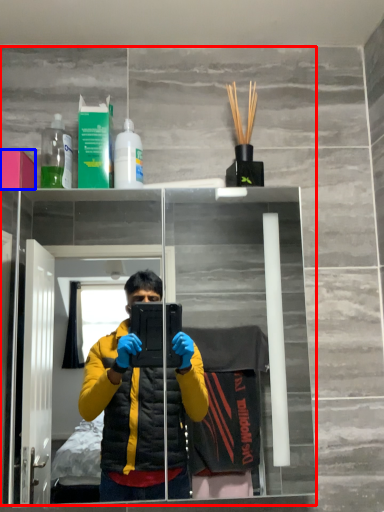
Question: Among these objects, which one is nearest to the camera, mirror (highlighted by a red box) or box (highlighted by a blue box)?

Choices:
 (A) mirror
 (B) box

Answer: (A)